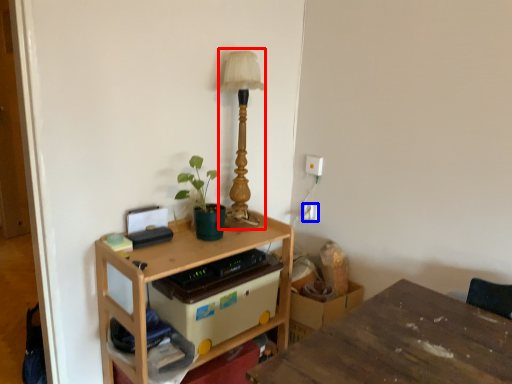
Question: Which object is further to the camera taking this photo, table lamp (highlighted by a red box) or electric outlet (highlighted by a blue box)?

Choices:
 (A) table lamp
 (B) electric outlet

Answer: (B)